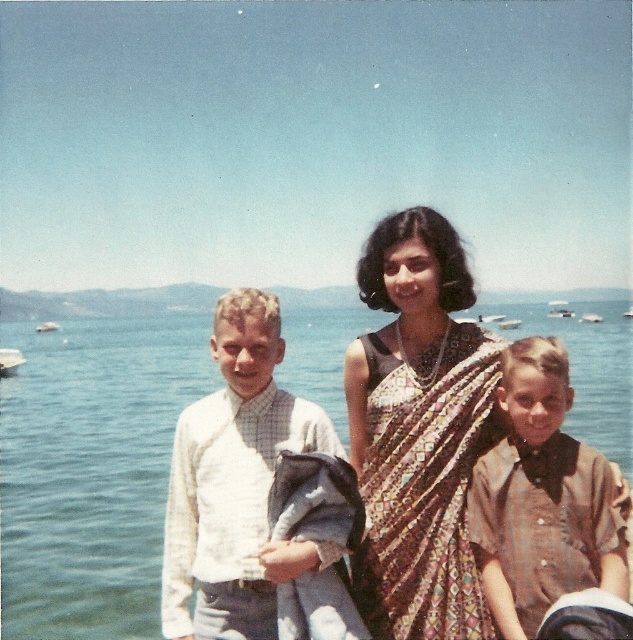
Question: Is the position of brown cotton shirt at lower right more distant than that of white plastic boat at left?

Choices:
 (A) yes
 (B) no

Answer: (B)

Question: Which object is the closest to the brown printed sari at center?

Choices:
 (A) white plastic boat at left
 (B) brown cotton shirt at lower right
 (C) white cotton shirt at left

Answer: (B)

Question: Among these objects, which one is farthest from the camera?

Choices:
 (A) white plastic boat at left
 (B) brown printed sari at center

Answer: (A)

Question: Can you confirm if brown printed sari at center is bigger than white cotton shirt at left?

Choices:
 (A) no
 (B) yes

Answer: (A)

Question: Which is nearer to the white plastic boat at left?

Choices:
 (A) white cotton shirt at left
 (B) brown printed sari at center
 (C) brown cotton shirt at lower right

Answer: (A)

Question: Can you confirm if blue water at center is wider than brown printed sari at center?

Choices:
 (A) no
 (B) yes

Answer: (B)